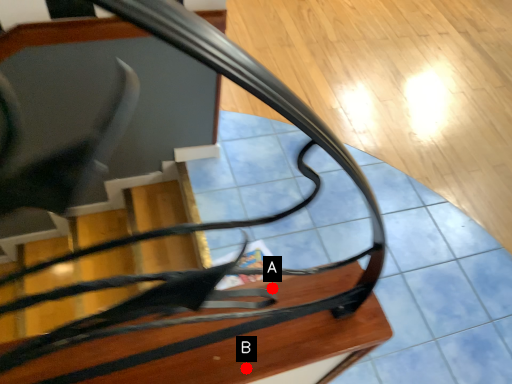
Question: Two points are circled on the image, labeled by A and B beside each circle. Which point is closer to the camera?

Choices:
 (A) A is closer
 (B) B is closer

Answer: (B)